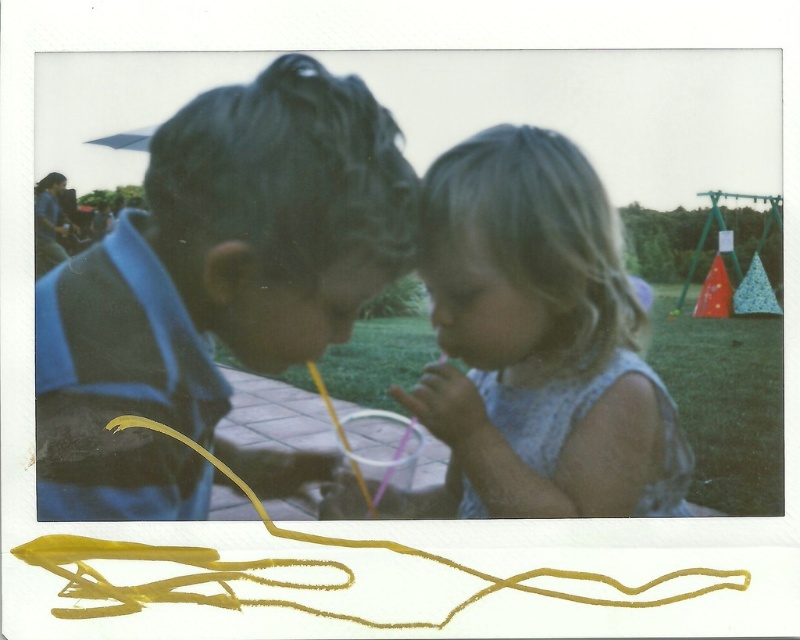
You are a photographer trying to capture a candid shot of the two children in the scene. Which child should you focus on first to ensure they are in sharp focus, the blue striped shirt at left or the light blue fabric dress at center?

The blue striped shirt at left is closer to the viewer than the light blue fabric dress at center, so you should focus on the blue striped shirt at left first to ensure sharpness.

In the vintage Polaroid image, there are two children dressed in a blue striped shirt at left and a light blue fabric dress at center. Which child is taller?

The blue striped shirt at left is taller than the light blue fabric dress at center, so the child in the blue striped shirt at left is taller.

You are a photographer trying to capture a candid shot of the two children in the scene. Given that the blue striped shirt at left and the light blue fabric dress at center are visible, which clothing item would appear bigger in your photo?

The blue striped shirt at left appears bigger in the photo because it has a larger size compared to the light blue fabric dress at center.